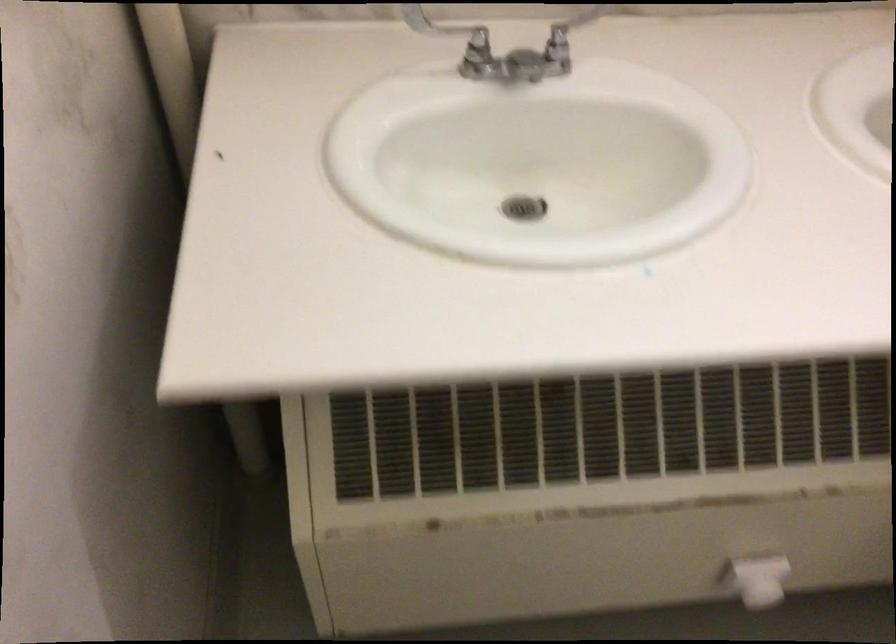
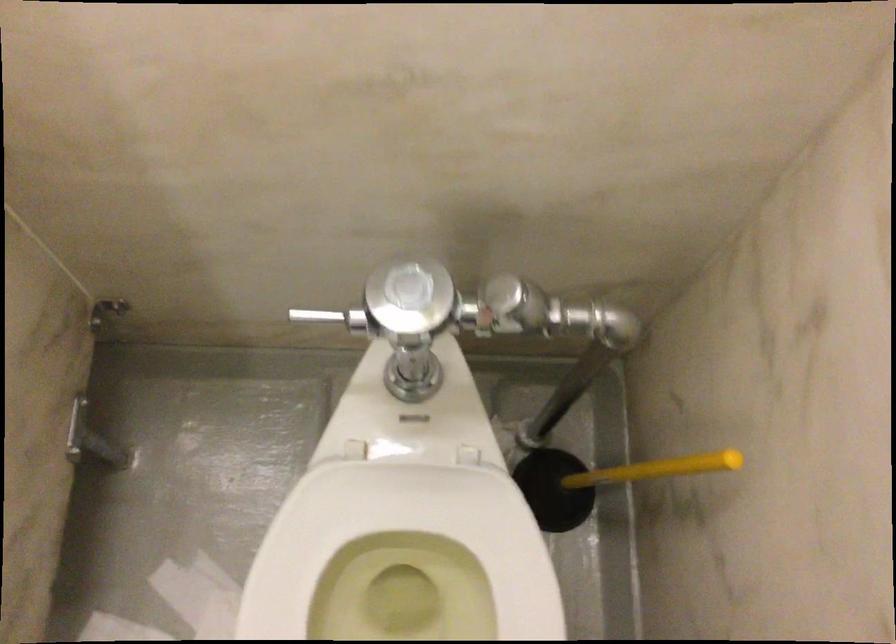
Question: Which direction would the cameraman need to move to produce the second image? Reply with the corresponding letter.

Choices:
 (A) Left
 (B) Right
 (C) Forward
 (D) Backward

Answer: (B)